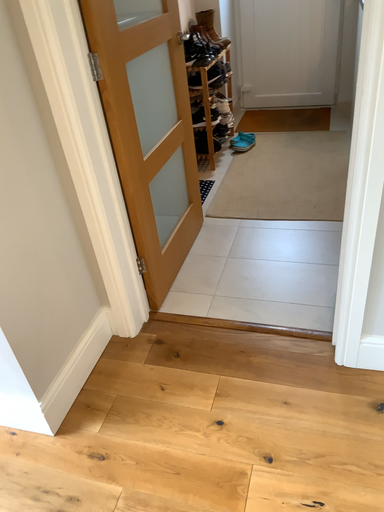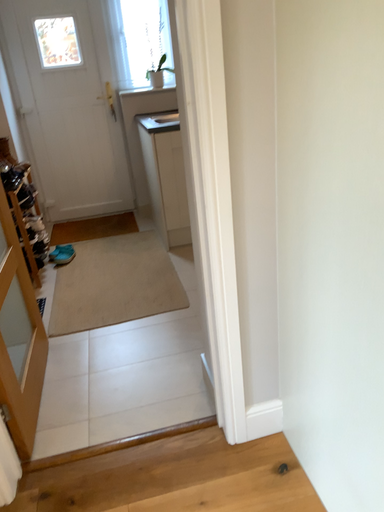
Question: Which way did the camera rotate in the video?

Choices:
 (A) rotated downward
 (B) rotated upward

Answer: (B)